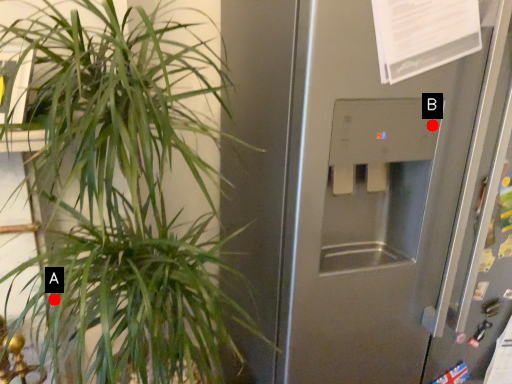
Question: Two points are circled on the image, labeled by A and B beside each circle. Which point is further to the camera?

Choices:
 (A) A is further
 (B) B is further

Answer: (B)